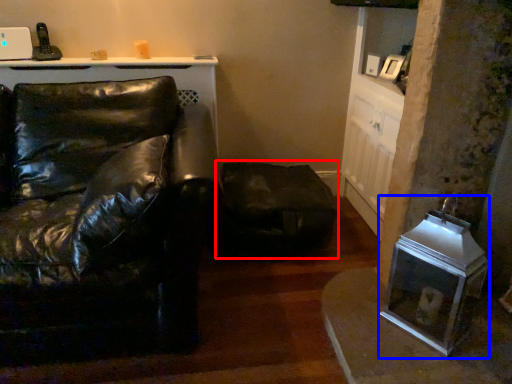
Question: Which object appears closest to the camera in this image, swivel chair (highlighted by a red box) or appliance (highlighted by a blue box)?

Choices:
 (A) swivel chair
 (B) appliance

Answer: (B)